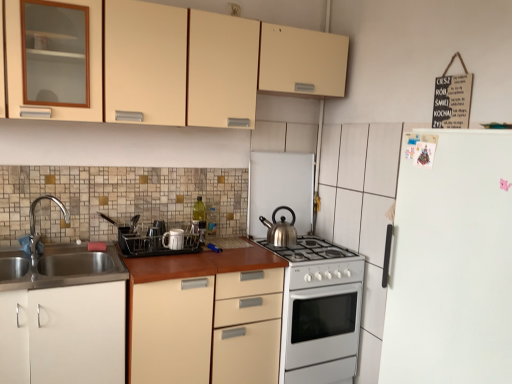
You are a GUI agent. You are given a task and a screenshot of the screen. Output one action in this format:
    pyautogui.click(x=<x>, y=<y>)
    Task: Click on the vacant region in front of glossy ceramic mug at center, which is the second appliance from right to left
    This screenshot has width=512, height=384.
    Given the screenshot: What is the action you would take?
    pyautogui.click(x=159, y=259)